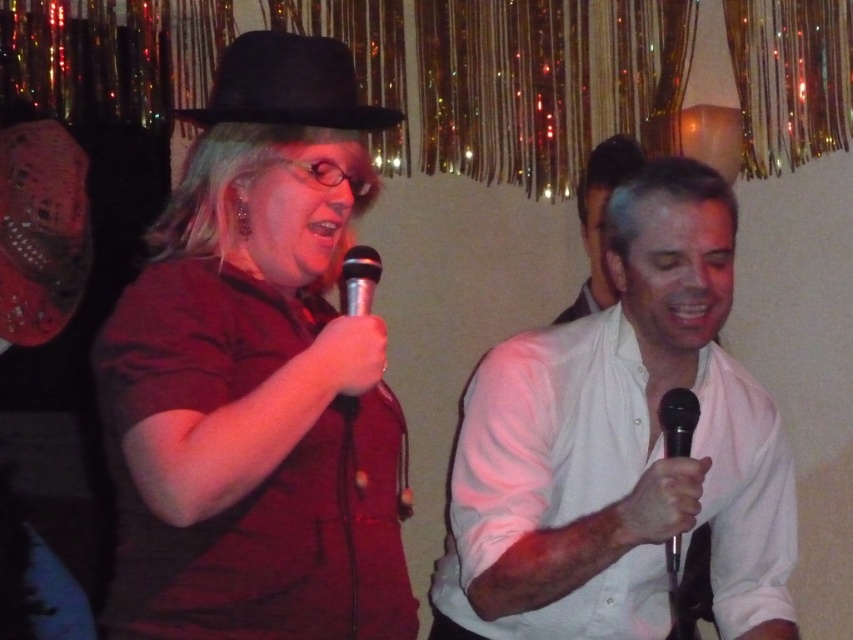
You are a sound technician at a live event. You need to adjust the microphone stand so that the black metallic microphone at right is positioned exactly 1 meter away from the audience. Currently, the microphone is 1.25 meters away from the camera. Assuming the audience is seated 2 meters behind the camera, is the microphone currently too far or too close to the audience?

The microphone is currently positioned 1.25 meters from the camera, and the audience is 2 meters behind the camera. This means the total distance from the microphone to the audience is 1.25 meters plus 2 meters, totaling 3.25 meters. Since the desired distance is 1 meter, the microphone is too far from the audience.

You are a photographer at the event and want to capture a shot where both the matte black hat at left and the black metallic microphone at center are visible. Based on their positions, which object should appear higher in the photo?

The black metallic microphone at center appears higher in the photo because the matte black hat at left is located below it.